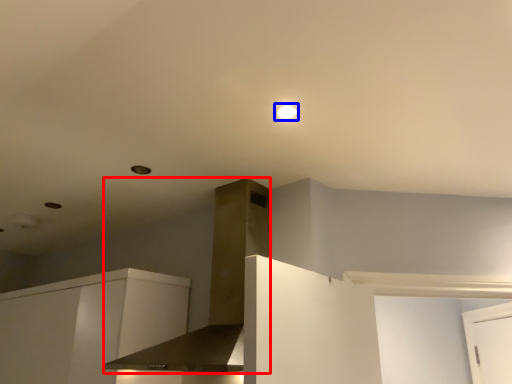
Question: Which point is closer to the camera, vent (highlighted by a red box) or lighting (highlighted by a blue box)?

Choices:
 (A) vent
 (B) lighting

Answer: (A)